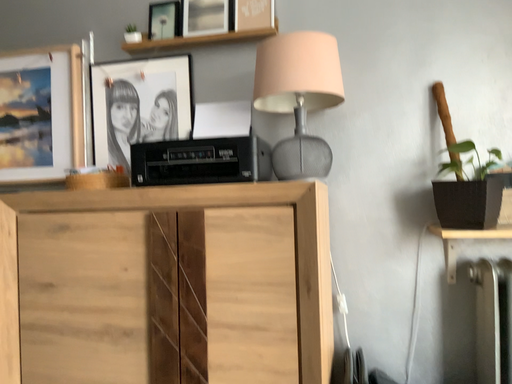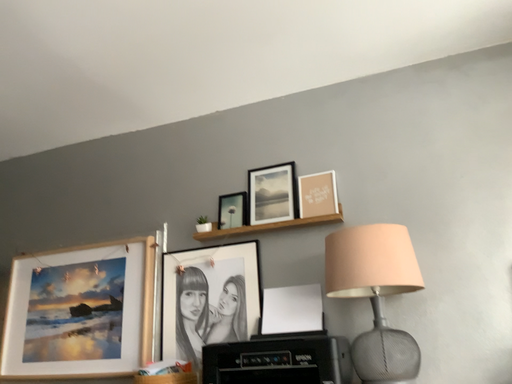
Question: Which way did the camera rotate in the video?

Choices:
 (A) rotated right
 (B) rotated left

Answer: (B)